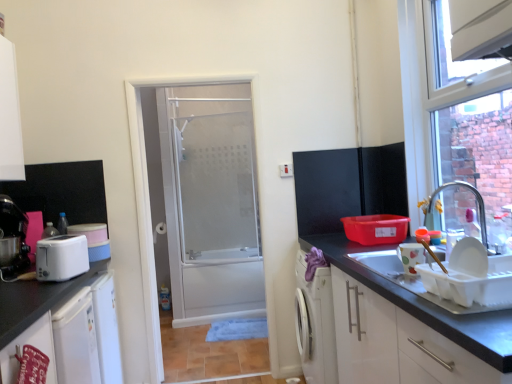
Question: Considering the relative sizes of matte black coffee machine at left and matte black cabinet at upper right in the image provided, is matte black coffee machine at left shorter than matte black cabinet at upper right?

Choices:
 (A) yes
 (B) no

Answer: (A)

Question: From the image's perspective, is matte black coffee machine at left on matte black cabinet at upper right?

Choices:
 (A) yes
 (B) no

Answer: (B)

Question: Is matte black coffee machine at left facing away from matte black cabinet at upper right?

Choices:
 (A) no
 (B) yes

Answer: (A)

Question: Could you tell me if matte black coffee machine at left is turned towards matte black cabinet at upper right?

Choices:
 (A) no
 (B) yes

Answer: (B)

Question: Is matte black coffee machine at left positioned behind matte black cabinet at upper right?

Choices:
 (A) yes
 (B) no

Answer: (B)

Question: Would you say matte black coffee machine at left contains matte black cabinet at upper right?

Choices:
 (A) yes
 (B) no

Answer: (B)

Question: Considering the relative positions of white glossy cabinet at lower right, which is counted as the 3th cabinetry, starting from the left, and white plastic toaster at left, which is the first appliance from back to front, in the image provided, is white glossy cabinet at lower right, which is counted as the 3th cabinetry, starting from the left, behind white plastic toaster at left, which is the first appliance from back to front,?

Choices:
 (A) no
 (B) yes

Answer: (A)

Question: Is white glossy cabinet at lower right, which is counted as the 3th cabinetry, starting from the left, bigger than white plastic toaster at left, which appears as the second appliance when viewed from the front?

Choices:
 (A) no
 (B) yes

Answer: (B)

Question: From the image's perspective, is white glossy cabinet at lower right, which is counted as the 3th cabinetry, starting from the left, below white plastic toaster at left, which is the first appliance from back to front?

Choices:
 (A) no
 (B) yes

Answer: (B)

Question: Considering the relative positions of white glossy cabinet at lower right, which is counted as the 3th cabinetry, starting from the left, and white plastic toaster at left, acting as the second appliance starting from the right, in the image provided, is white glossy cabinet at lower right, which is counted as the 3th cabinetry, starting from the left, to the left of white plastic toaster at left, acting as the second appliance starting from the right, from the viewer's perspective?

Choices:
 (A) yes
 (B) no

Answer: (B)

Question: From a real-world perspective, is white glossy cabinet at lower right, which is counted as the 3th cabinetry, starting from the left, under white plastic toaster at left, which appears as the second appliance when viewed from the front?

Choices:
 (A) no
 (B) yes

Answer: (B)

Question: Is white glossy cabinet at lower right, which is counted as the 3th cabinetry, starting from the left, not close to white plastic toaster at left, which ranks as the 1th appliance in left-to-right order?

Choices:
 (A) no
 (B) yes

Answer: (B)

Question: From the image's perspective, is white plastic toaster at left, acting as the second appliance starting from the right, on top of matte black cabinet at upper right?

Choices:
 (A) yes
 (B) no

Answer: (B)